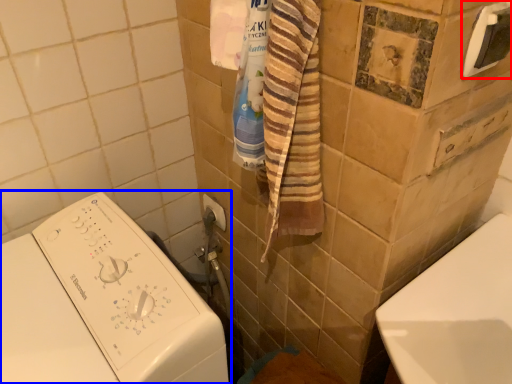
Question: Which object is further to the camera taking this photo, towel bar (highlighted by a red box) or washing machine (highlighted by a blue box)?

Choices:
 (A) towel bar
 (B) washing machine

Answer: (A)